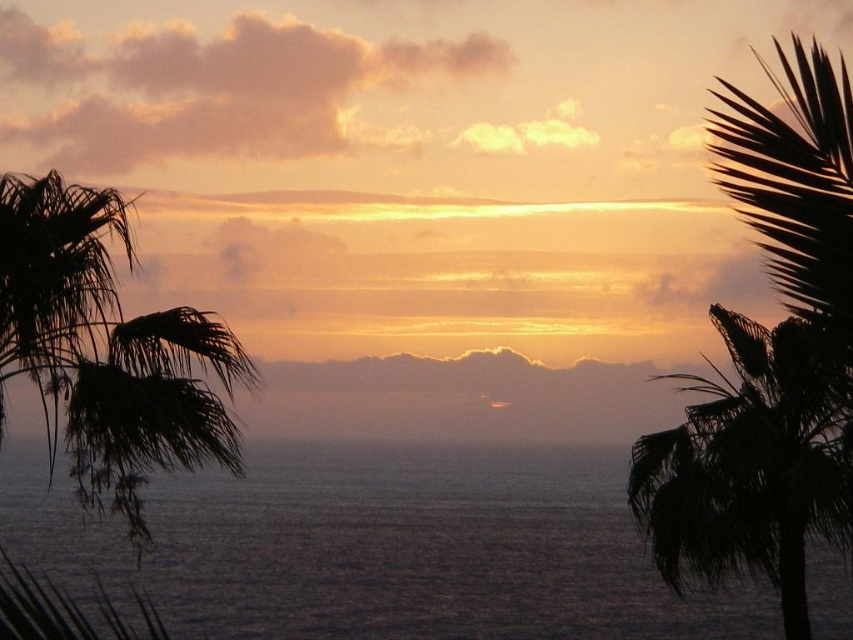
Between silhouette leafy palm at left and silhouette leafy palm at right, which one has less height?

silhouette leafy palm at right

Is the position of silhouette leafy palm at left more distant than that of silhouette leafy palm at right?

No.

Which is behind, point (33, 225) or point (837, 529)?

The point (837, 529) is behind.

This screenshot has height=640, width=853. In order to click on silhouette leafy palm at left in this screenshot , I will do `click(106, 349)`.

What do you see at coordinates (383, 547) in the screenshot?
I see `dark gray water at center` at bounding box center [383, 547].

Is dark gray water at center to the left of silhouette leafy palm at right from the viewer's perspective?

Indeed, dark gray water at center is positioned on the left side of silhouette leafy palm at right.

Which is in front, point (213, 557) or point (691, 376)?

Point (691, 376) is more forward.

The image size is (853, 640). Find the location of `dark gray water at center`. dark gray water at center is located at coordinates (383, 547).

Does point (41, 477) lie in front of point (180, 449)?

No.

Who is more forward, (492, 513) or (77, 401)?

Point (77, 401)

Image resolution: width=853 pixels, height=640 pixels. I want to click on dark gray water at center, so click(383, 547).